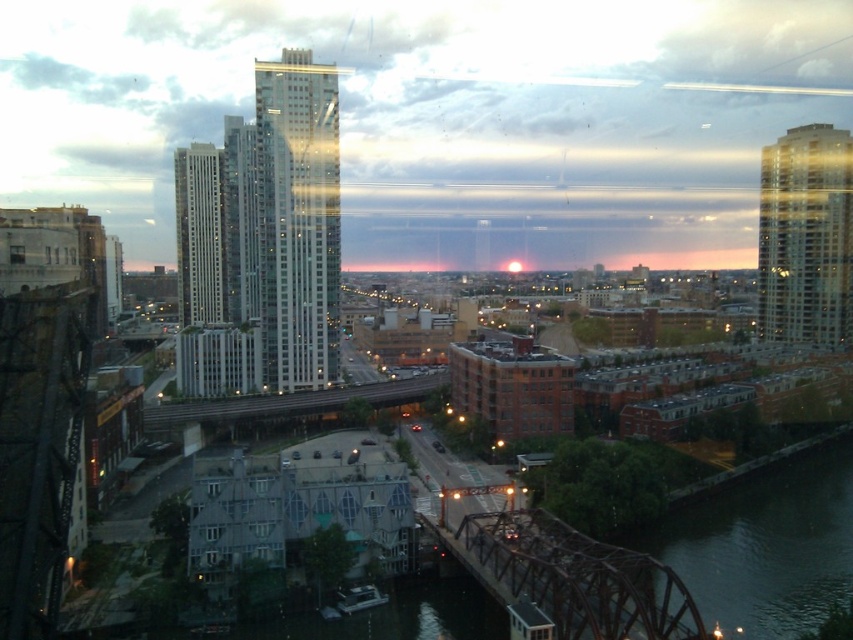
Question: Which point is farther to the camera?

Choices:
 (A) glassy reflective skyscraper at upper right
 (B) metallic gray bridge at center

Answer: (A)

Question: Observing the image, what is the correct spatial positioning of glassy reflective skyscraper at center in reference to white glass skyscraper at center?

Choices:
 (A) right
 (B) left

Answer: (A)

Question: Can you confirm if white glass skyscraper at center is positioned above metallic gray bridge at center?

Choices:
 (A) yes
 (B) no

Answer: (A)

Question: Is matte glass skyscraper at center smaller than metallic gray bridge at center?

Choices:
 (A) yes
 (B) no

Answer: (B)

Question: Which point is closer to the camera?

Choices:
 (A) glassy reflective skyscraper at upper right
 (B) dark brown metal bridge at lower center
 (C) dark green water at lower right

Answer: (B)

Question: Which object appears closest to the camera in this image?

Choices:
 (A) glassy reflective skyscraper at upper right
 (B) white glass skyscraper at center
 (C) metallic gray bridge at center
 (D) dark brown metal bridge at lower center

Answer: (D)